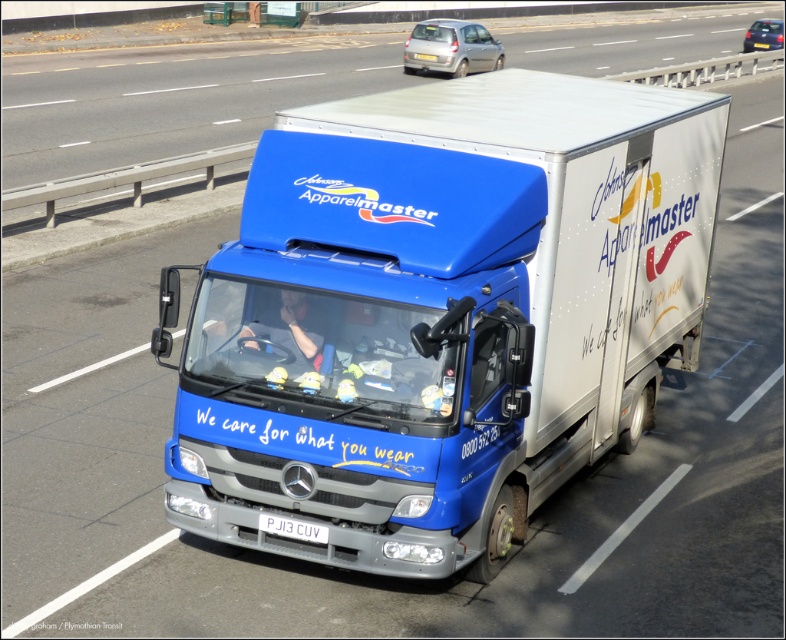
Who is lower down, blue metallic truck at center or white plastic license plate at center?

white plastic license plate at center is below.

In the scene shown: Who is positioned more to the right, blue metallic truck at center or white plastic license plate at center?

blue metallic truck at center is more to the right.

This screenshot has height=640, width=786. What are the coordinates of `blue metallic truck at center` in the screenshot? It's located at (443, 314).

You are a GUI agent. You are given a task and a screenshot of the screen. Output one action in this format:
    pyautogui.click(x=<x>, y=<y>)
    Task: Click on the blue metallic truck at center
    The width and height of the screenshot is (786, 640).
    Given the screenshot: What is the action you would take?
    pyautogui.click(x=443, y=314)